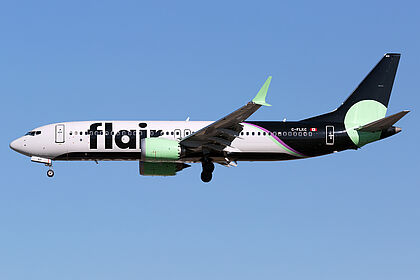
Where is `doors`? doors is located at coordinates (61, 136), (330, 136).